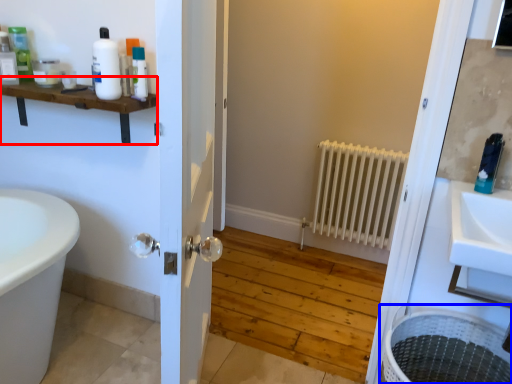
Question: Which object is further to the camera taking this photo, balustrade (highlighted by a red box) or laundry basket (highlighted by a blue box)?

Choices:
 (A) balustrade
 (B) laundry basket

Answer: (A)